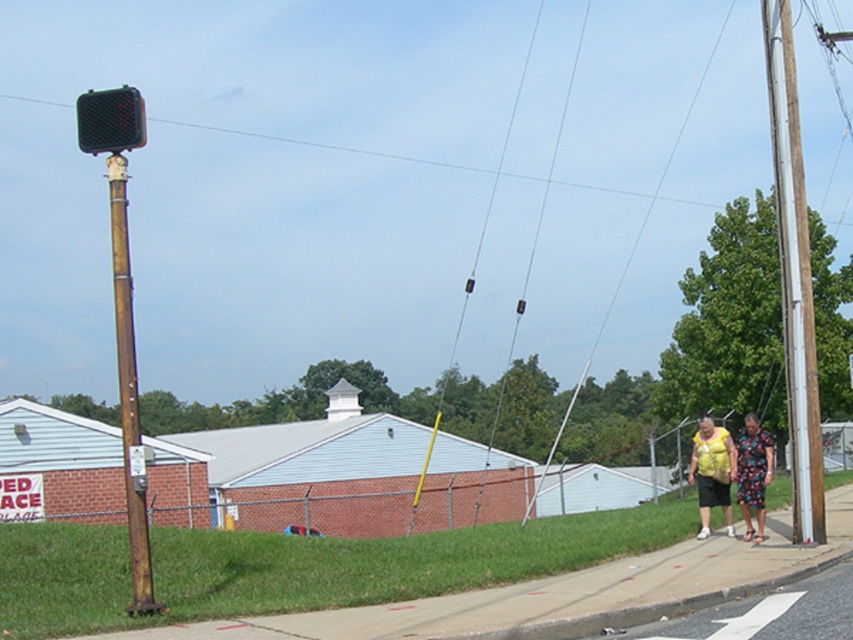
Is white painted wood pole at right in front of rusty metal pole at left?

No, white painted wood pole at right is further to the viewer.

Does white painted wood pole at right have a greater height compared to rusty metal pole at left?

Yes.

Image resolution: width=853 pixels, height=640 pixels. Identify the location of white painted wood pole at right. (793, 275).

Measure the distance between point (125, 272) and camera.

The distance of point (125, 272) from camera is 30.87 feet.

Does rusty metal pole at left have a greater height compared to yellow fabric dress at lower right?

Yes.

Image resolution: width=853 pixels, height=640 pixels. Identify the location of rusty metal pole at left. (128, 392).

Between white painted wood pole at right and yellow fabric dress at lower right, which one appears on the left side from the viewer's perspective?

white painted wood pole at right is more to the left.

Is white painted wood pole at right in front of yellow fabric dress at lower right?

Yes.

Is point (782, 125) less distant than point (744, 444)?

That is True.

Identify the location of white painted wood pole at right. (793, 275).